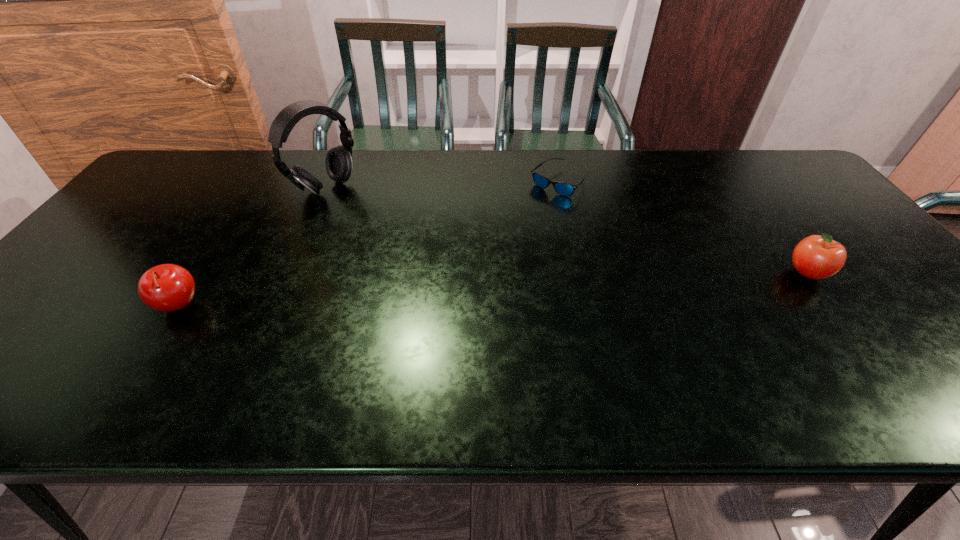
This screenshot has width=960, height=540. In order to click on object that is the second closest one to the second object from right to left in this screenshot , I will do `click(338, 162)`.

Identify which object is located as the nearest to the shortest object. Please provide its 2D coordinates. Your answer should be formatted as a tuple, i.e. [(x, y)], where the tuple contains the x and y coordinates of a point satisfying the conditions above.

[(819, 256)]

Where is `vacant space that satisfies the following two spatial constraints: 1. on the front side of the rightmost object; 2. on the right side of the earphone`? Image resolution: width=960 pixels, height=540 pixels. vacant space that satisfies the following two spatial constraints: 1. on the front side of the rightmost object; 2. on the right side of the earphone is located at coordinates (289, 273).

At what (x,y) coordinates should I click in order to perform the action: click on free space that satisfies the following two spatial constraints: 1. on the back side of the leftmost object; 2. on the right side of the third object from right to left. Please return your answer as a coordinate pair (x, y). Looking at the image, I should click on (253, 188).

Where is `free point that satisfies the following two spatial constraints: 1. on the front side of the apple; 2. on the right side of the shortest object`? free point that satisfies the following two spatial constraints: 1. on the front side of the apple; 2. on the right side of the shortest object is located at coordinates (579, 273).

At what (x,y) coordinates should I click in order to perform the action: click on vacant point that satisfies the following two spatial constraints: 1. on the back side of the tallest object; 2. on the left side of the cherry. Please return your answer as a coordinate pair (x, y). This screenshot has width=960, height=540. Looking at the image, I should click on pyautogui.click(x=253, y=188).

Locate an element on the screen. This screenshot has height=540, width=960. free location that satisfies the following two spatial constraints: 1. on the front side of the sunglasses; 2. on the right side of the apple is located at coordinates (579, 273).